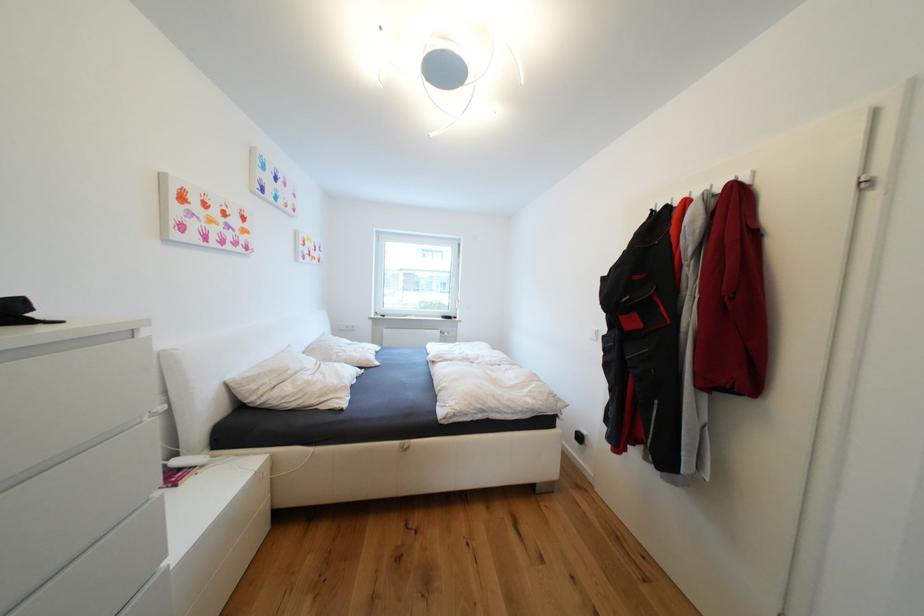
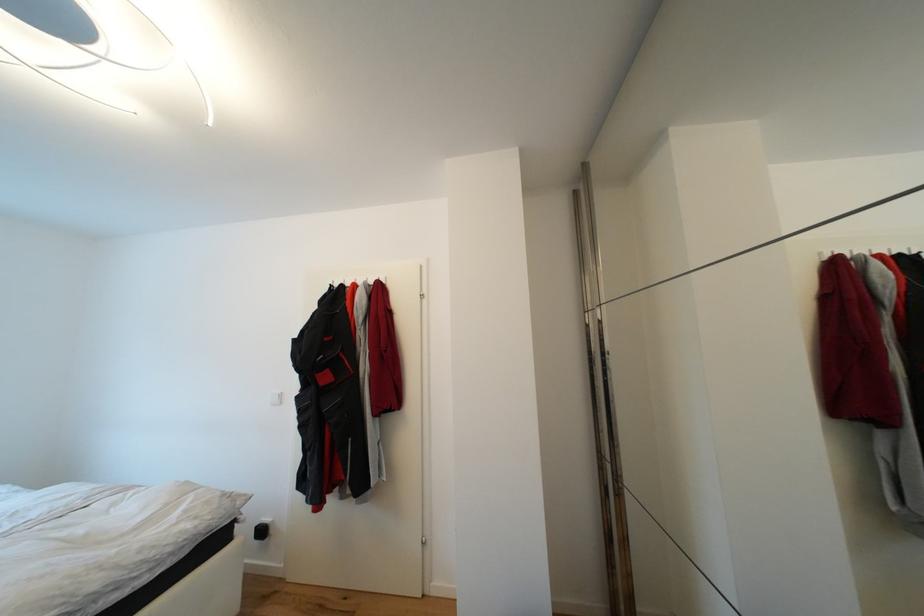
Question: How did the camera likely rotate?

Choices:
 (A) Left
 (B) Right
 (C) Up
 (D) Down

Answer: (B)